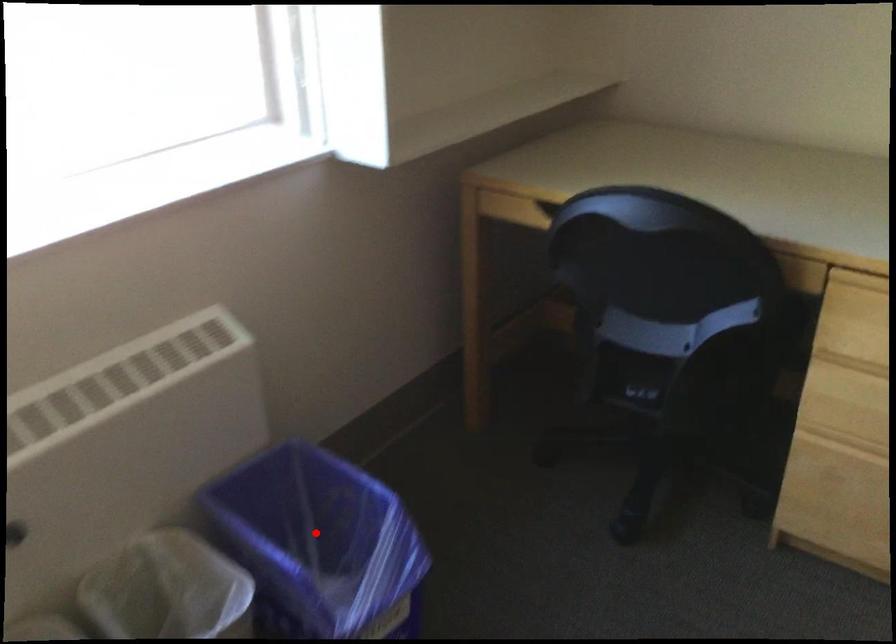
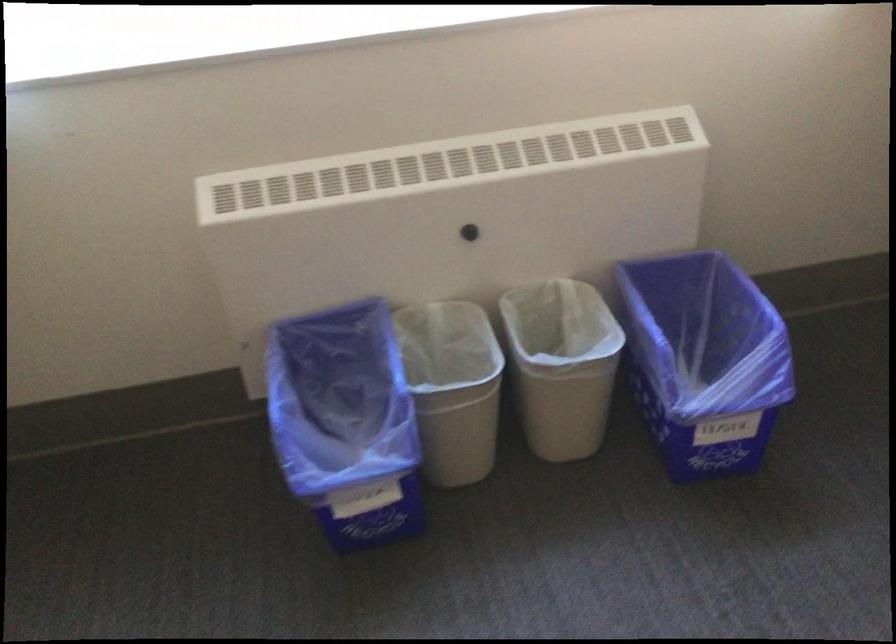
Find the pixel in the second image that matches the highlighted location in the first image.

(702, 339)